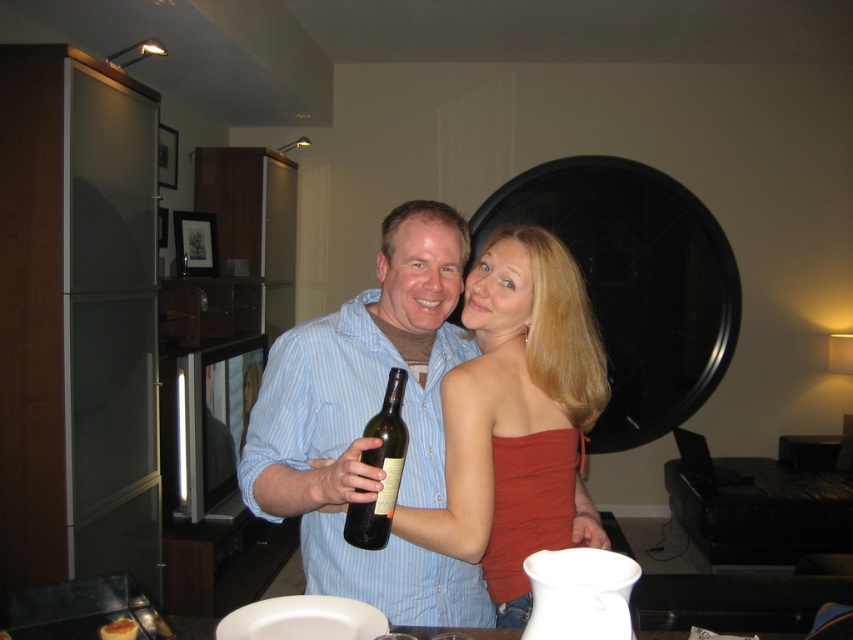
Question: Estimate the real-world distances between objects in this image. Which object is farther from the matte red strapless top at center?

Choices:
 (A) green glass bottle at center
 (B) matte blue shirt at center

Answer: (A)

Question: Among these objects, which one is nearest to the camera?

Choices:
 (A) green glass bottle at center
 (B) matte red strapless top at center
 (C) matte blue shirt at center

Answer: (C)

Question: Is matte blue shirt at center positioned before matte red strapless top at center?

Choices:
 (A) no
 (B) yes

Answer: (B)

Question: Among these points, which one is nearest to the camera?

Choices:
 (A) (352, 337)
 (B) (351, 516)
 (C) (492, 492)

Answer: (B)

Question: From the image, what is the correct spatial relationship of matte blue shirt at center in relation to matte red strapless top at center?

Choices:
 (A) above
 (B) below

Answer: (A)

Question: Observing the image, what is the correct spatial positioning of matte blue shirt at center in reference to matte red strapless top at center?

Choices:
 (A) left
 (B) right

Answer: (A)